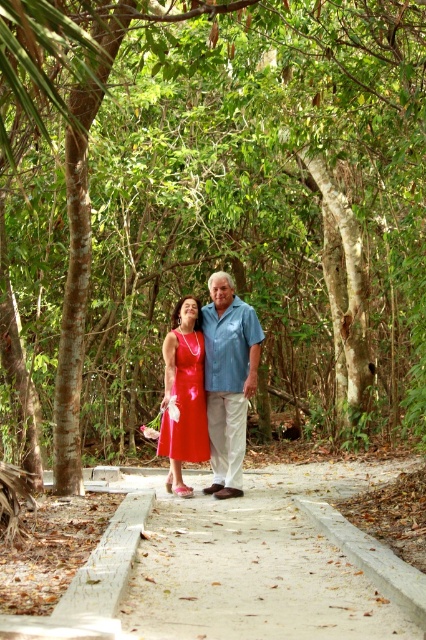
Measure the distance between point (x=239, y=392) and camera.

31.79 feet

Which is more to the right, matte blue shirt at center or shiny satin dress at center?

matte blue shirt at center

Find the location of a particular element. matte blue shirt at center is located at coordinates (229, 380).